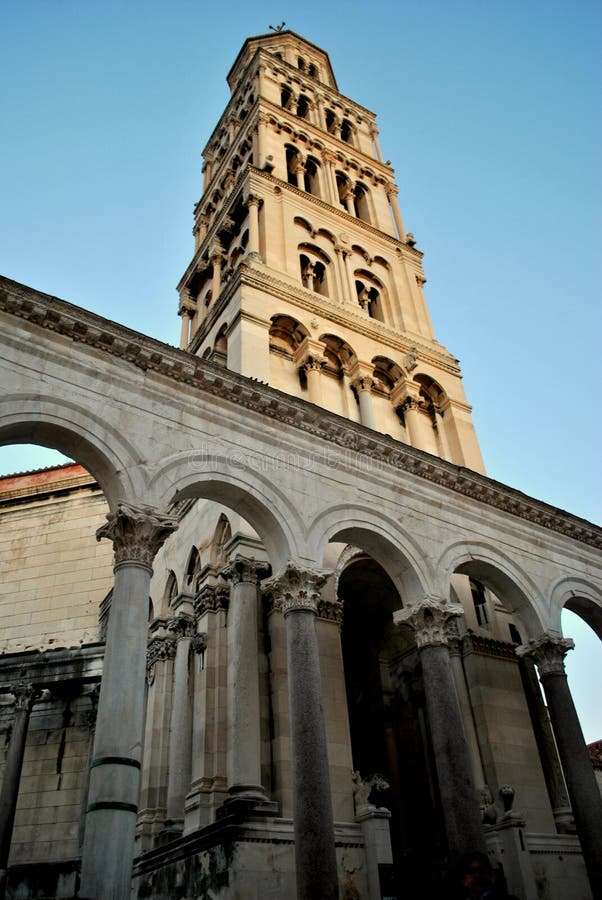
Where is `pillars 2nd floor`? Image resolution: width=602 pixels, height=900 pixels. pillars 2nd floor is located at coordinates (315, 390), (368, 400), (411, 415).